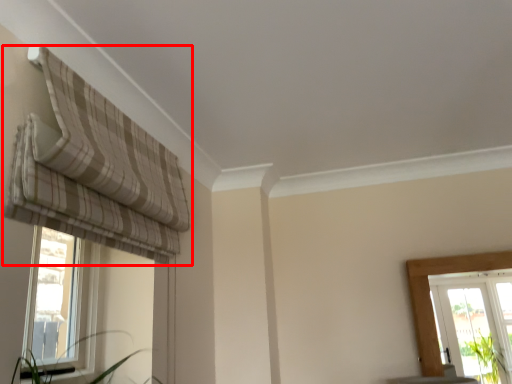
Question: Where is curtain (annotated by the red box) located in relation to window in the image?

Choices:
 (A) left
 (B) right

Answer: (B)